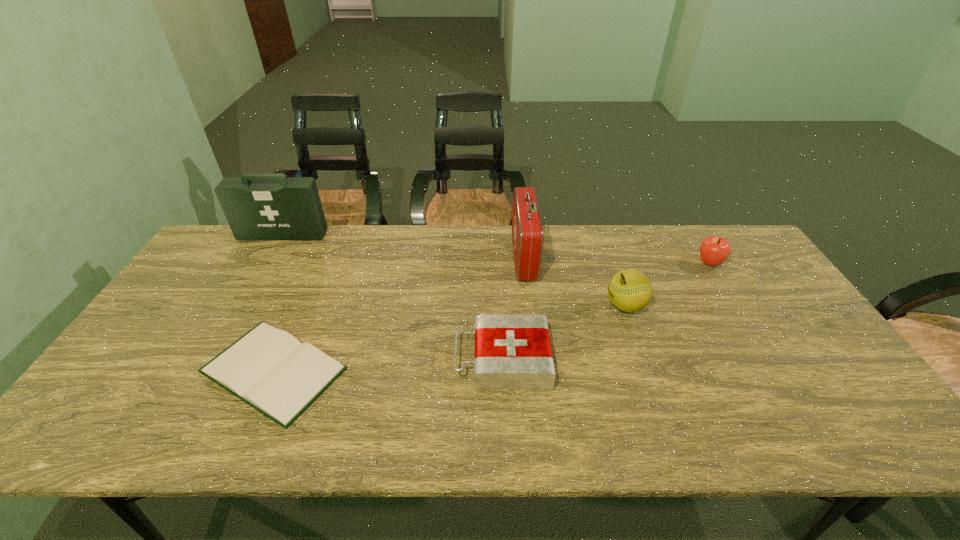
Locate an element on the screen. The height and width of the screenshot is (540, 960). free spot located 0.360m on the logo side of the third nearest object is located at coordinates (480, 306).

This screenshot has width=960, height=540. Find the location of `vacant point located 0.070m on the front of the rightmost object`. vacant point located 0.070m on the front of the rightmost object is located at coordinates (724, 287).

The image size is (960, 540). Identify the location of vacant space situated 0.240m on the front side of the shortest first-aid kit. (361, 359).

Locate an element on the screen. This screenshot has width=960, height=540. vacant space situated 0.280m on the front side of the shortest first-aid kit is located at coordinates (346, 359).

The image size is (960, 540). Identify the location of vacant region located 0.260m on the front side of the shortest first-aid kit. (353, 359).

The image size is (960, 540). Find the location of `vacant area situated 0.120m on the back of the hardback book`. vacant area situated 0.120m on the back of the hardback book is located at coordinates coord(307,293).

This screenshot has width=960, height=540. Identify the location of apple that is positioned at the far edge. (714, 250).

You are a GUI agent. You are given a task and a screenshot of the screen. Output one action in this format:
    pyautogui.click(x=<x>, y=<y>)
    Task: Click on the object that is at the near edge
    This screenshot has height=540, width=960.
    Given the screenshot: What is the action you would take?
    pyautogui.click(x=269, y=369)

Image resolution: width=960 pixels, height=540 pixels. I want to click on object present at the left edge, so click(258, 206).

The width and height of the screenshot is (960, 540). Find the location of `object at the right edge`. object at the right edge is located at coordinates (714, 250).